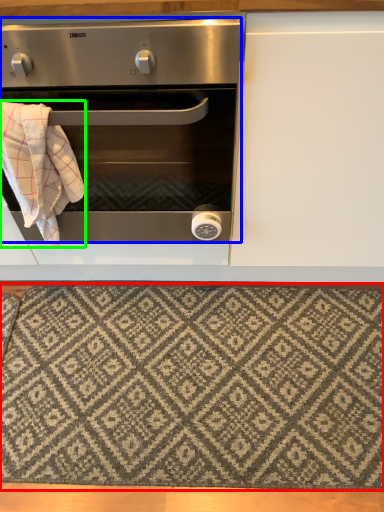
Question: Which is nearer to the mat (highlighted by a red box)? oven (highlighted by a blue box) or blanket (highlighted by a green box).

Choices:
 (A) oven
 (B) blanket

Answer: (A)